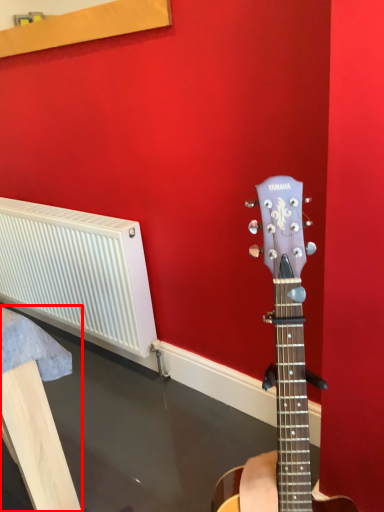
Question: From the image's perspective, where is furniture (annotated by the red box) located relative to radiator?

Choices:
 (A) below
 (B) above

Answer: (A)